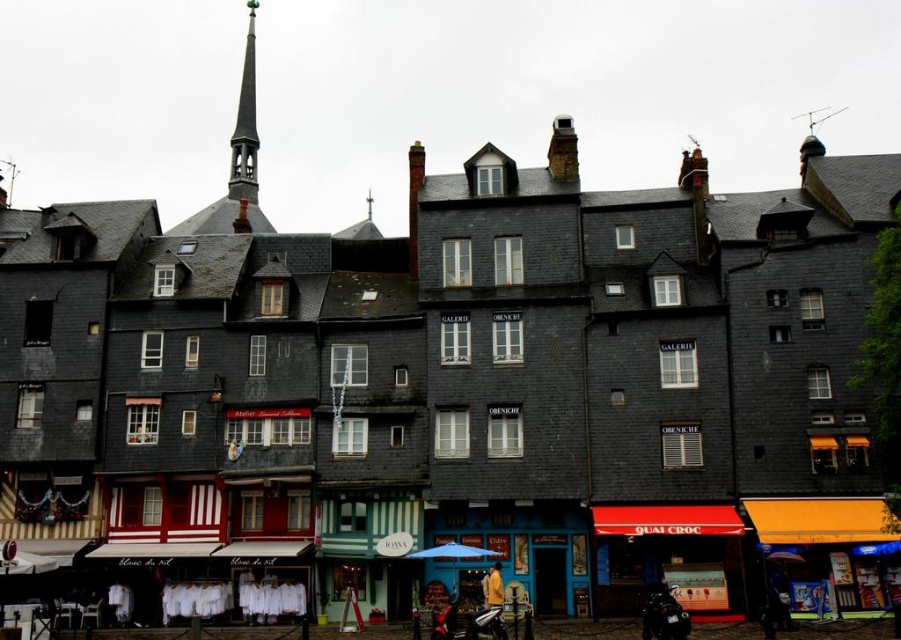
Which is below, orange fabric awning at lower right or blue fabric umbrella at center?

blue fabric umbrella at center

Who is positioned more to the right, orange fabric awning at lower right or blue fabric umbrella at center?

From the viewer's perspective, orange fabric awning at lower right appears more on the right side.

Between point (803, 499) and point (444, 556), which one is positioned behind?

Point (803, 499)

This screenshot has height=640, width=901. I want to click on orange fabric awning at lower right, so click(821, 518).

Can you confirm if blue painted wooden shop at center is positioned above red awning at lower right?

No, blue painted wooden shop at center is not above red awning at lower right.

Which is behind, point (466, 516) or point (727, 513)?

Positioned behind is point (466, 516).

At what (x,y) coordinates should I click in order to perform the action: click on blue painted wooden shop at center. Please return your answer as a coordinate pair (x, y). Looking at the image, I should click on (517, 548).

The width and height of the screenshot is (901, 640). I want to click on blue painted wooden shop at center, so click(517, 548).

Does white cotton laundry at center have a greater width compared to blue fabric umbrella at center?

Yes.

Can you confirm if white cotton laundry at center is shorter than blue fabric umbrella at center?

No, white cotton laundry at center is not shorter than blue fabric umbrella at center.

Where is `white cotton laundry at center`? The image size is (901, 640). white cotton laundry at center is located at coordinates (190, 600).